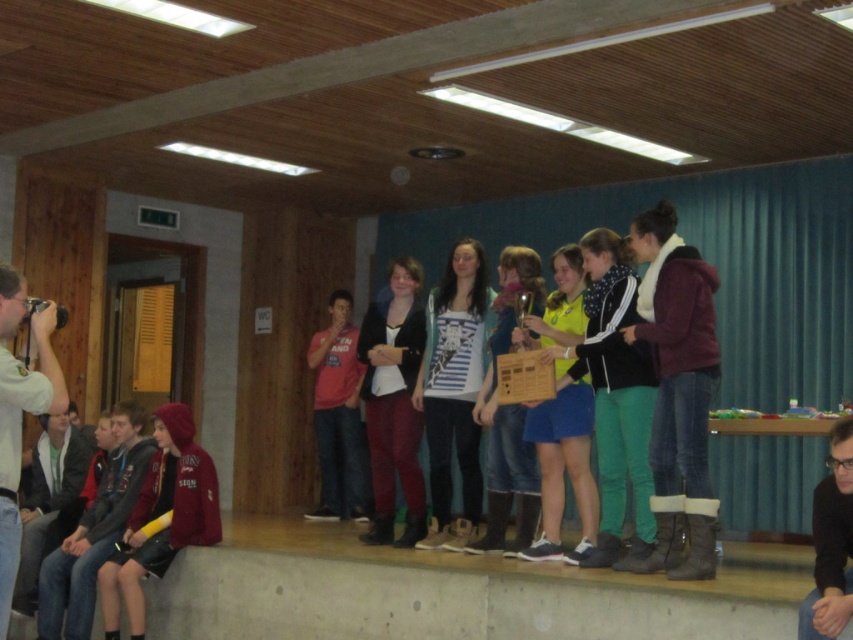
You are standing in the hall and want to move from point A to point B. Point A is at coordinates point (143, 504) and point B is at coordinates point (0, 516). Which point is closer to the wooden paneling on the walls?

Point (0, 516) is closer to the wooden paneling on the walls because it is in front of point (143, 504).

In the scene shown: You are standing in the hall and want to move from the point at coordinates point (376, 336) to the point at coordinates point (25, 285). Which direction should you move?

You should move forward because point (376, 336) is behind point (25, 285), so moving forward from point (376, 336) will lead you toward point (25, 285).

You are organizing a photo shoot and need to ensure that both the maroon fleece jacket at right and the red hoodie at lower left are visible in the frame. Based on their positions, which clothing item is closer to the camera?

The maroon fleece jacket at right is positioned over the red hoodie at lower left, meaning it is closer to the camera.